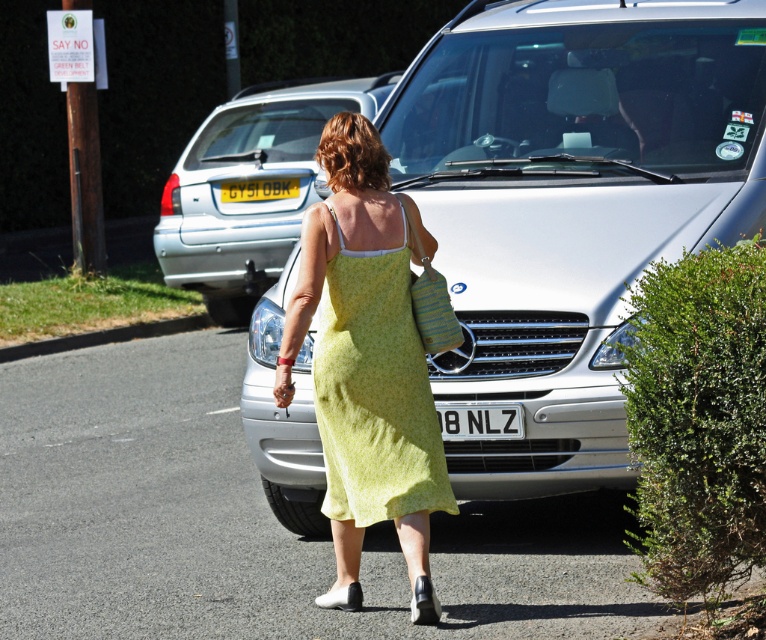
Question: Which object appears farthest from the camera in this image?

Choices:
 (A) silver metallic car at center
 (B) yellow plastic license plate at center

Answer: (B)

Question: Which object appears farthest from the camera in this image?

Choices:
 (A) linen green dress at center
 (B) yellow plastic license plate at center

Answer: (B)

Question: Is linen green dress at center to the left of yellow plastic license plate at center from the viewer's perspective?

Choices:
 (A) yes
 (B) no

Answer: (B)

Question: Is linen green dress at center further to camera compared to yellow plastic license plate at center?

Choices:
 (A) yes
 (B) no

Answer: (B)

Question: Is silver metallic car at center wider than white plastic license plate at center?

Choices:
 (A) yes
 (B) no

Answer: (A)

Question: Among these objects, which one is farthest from the camera?

Choices:
 (A) white plastic license plate at center
 (B) silver metallic car at center

Answer: (A)